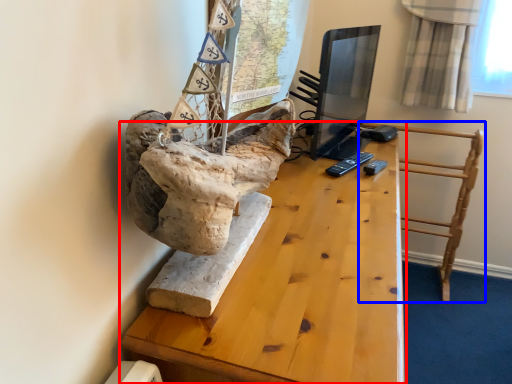
Question: Which of the following is the farthest to the observer, table (highlighted by a red box) or furniture (highlighted by a blue box)?

Choices:
 (A) table
 (B) furniture

Answer: (B)